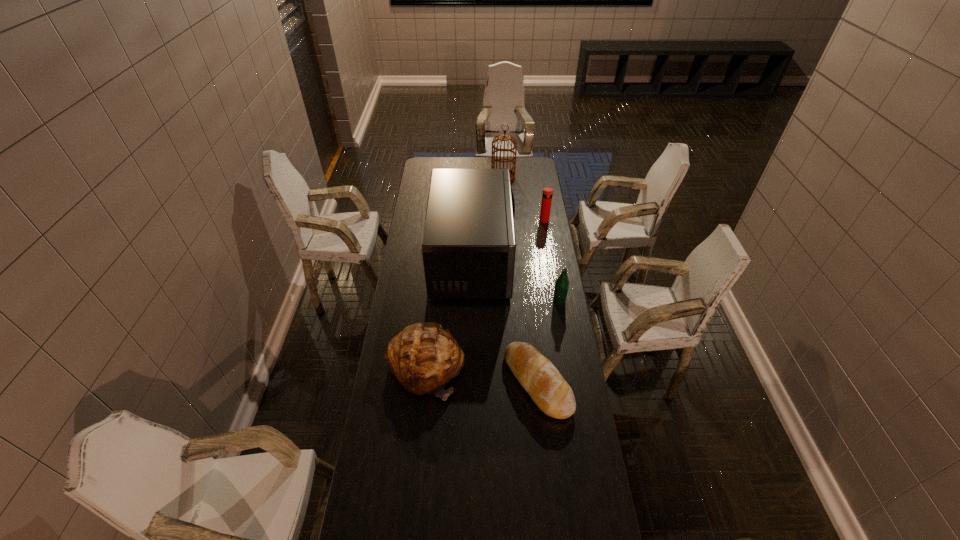
Where is `birdcage`? The image size is (960, 540). birdcage is located at coordinates (502, 137).

Find the location of a particular element. This screenshot has height=540, width=960. microwave oven is located at coordinates (468, 247).

Locate an element on the screen. The image size is (960, 540). thermos bottle is located at coordinates (547, 194).

Where is `bottle`? This screenshot has height=540, width=960. bottle is located at coordinates (562, 283).

The height and width of the screenshot is (540, 960). Identify the location of the left bread. (424, 357).

The width and height of the screenshot is (960, 540). What are the coordinates of `the right bread` in the screenshot? It's located at (537, 375).

Image resolution: width=960 pixels, height=540 pixels. Find the location of `the shortest object`. the shortest object is located at coordinates (537, 375).

Identify the location of vacant region located on the left of the birdcage. (431, 178).

Locate an element on the screen. free space located 0.140m on the front-facing side of the microwave oven is located at coordinates (542, 259).

The width and height of the screenshot is (960, 540). I want to click on vacant region located 0.370m on the front of the thermos bottle, so click(x=553, y=273).